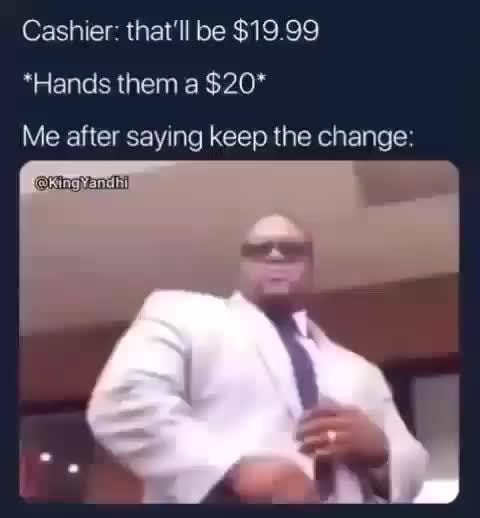
Locate an element on the screen. Image resolution: width=480 pixels, height=518 pixels. ceiling is located at coordinates (172, 196).